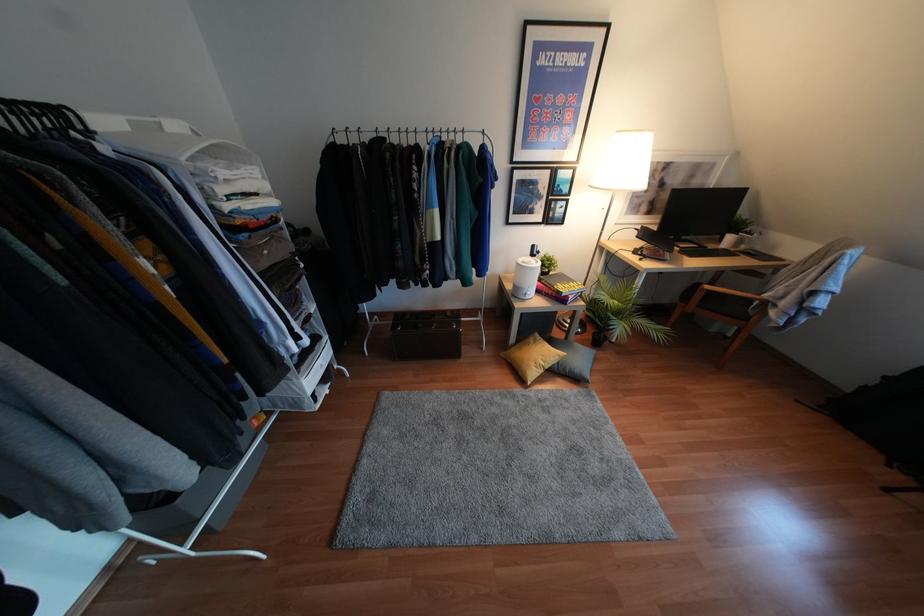
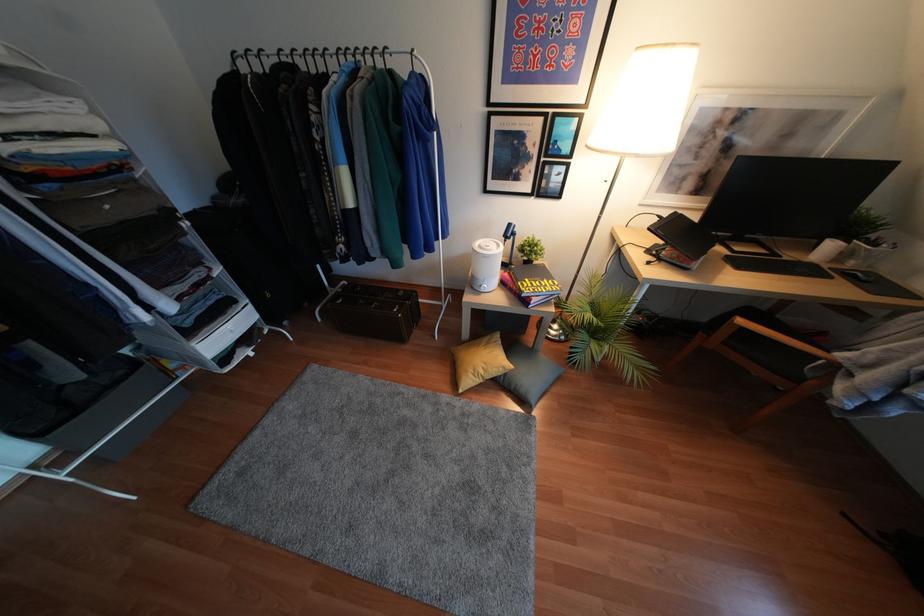
Find the pixel in the second image that matches (642,233) in the first image.

(666, 224)